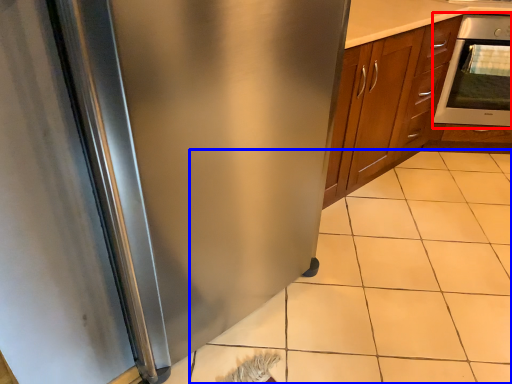
Question: Which of the following is the closest to the observer, oven (highlighted by a red box) or tile (highlighted by a blue box)?

Choices:
 (A) oven
 (B) tile

Answer: (B)